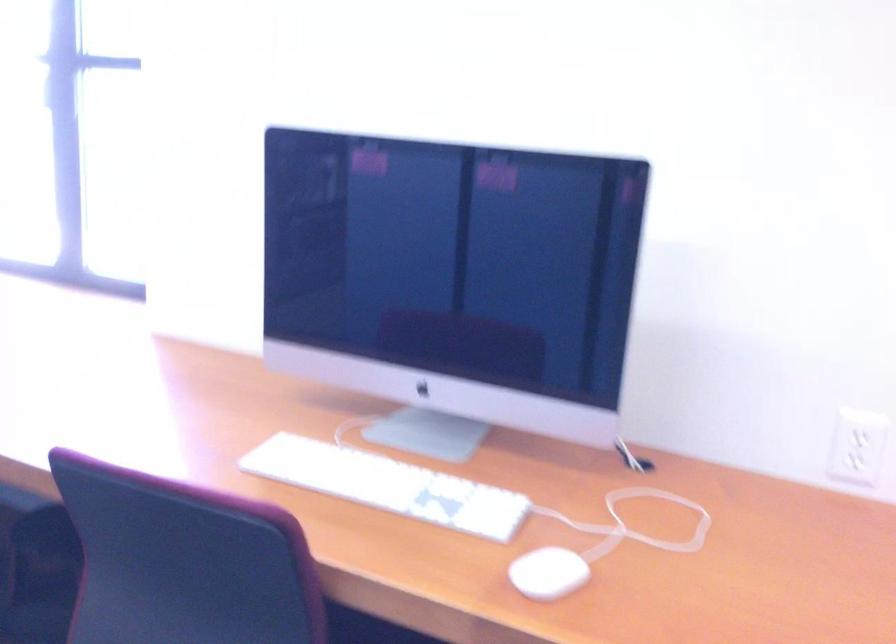
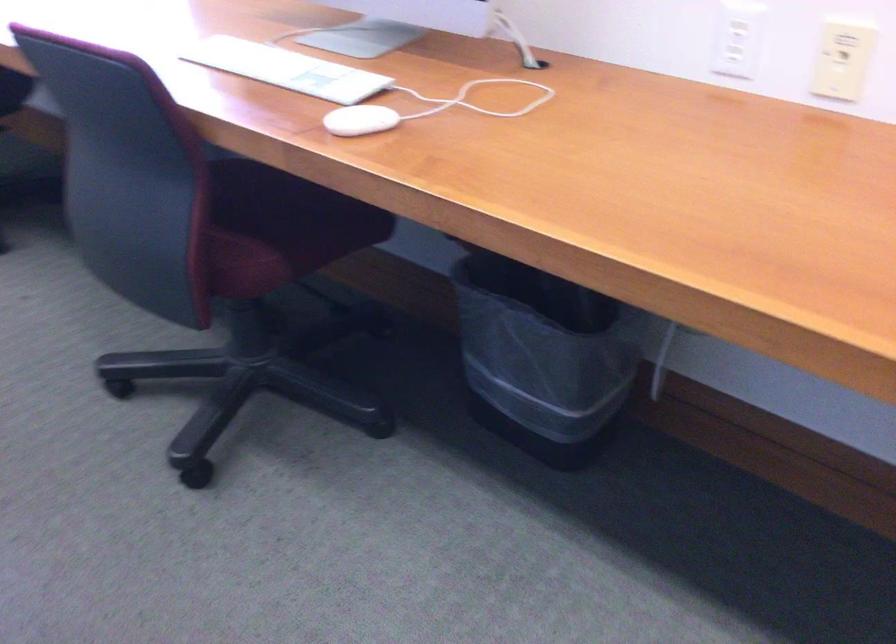
Find the pixel in the second image that matches (x=545, y=571) in the first image.

(359, 120)